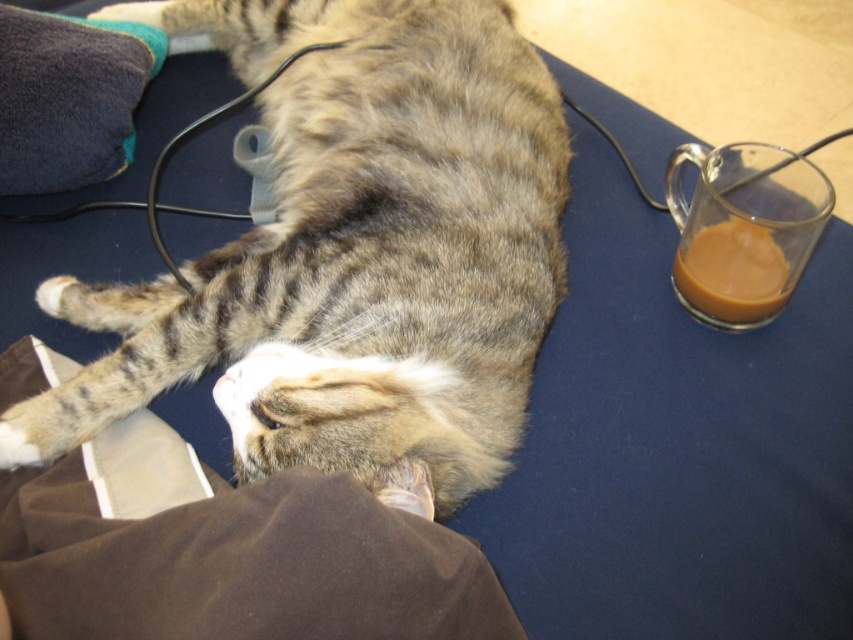
Question: Observing the image, what is the correct spatial positioning of tabby fur cat at center in reference to translucent glass mug at right?

Choices:
 (A) above
 (B) below

Answer: (A)

Question: Does tabby fur cat at center appear under translucent glass mug at right?

Choices:
 (A) yes
 (B) no

Answer: (B)

Question: Among these objects, which one is farthest from the camera?

Choices:
 (A) tabby fur cat at center
 (B) translucent glass mug at right

Answer: (B)

Question: Observing the image, what is the correct spatial positioning of tabby fur cat at center in reference to translucent glass mug at right?

Choices:
 (A) right
 (B) left

Answer: (B)

Question: Among these points, which one is farthest from the camera?

Choices:
 (A) (746, 269)
 (B) (387, 337)

Answer: (A)